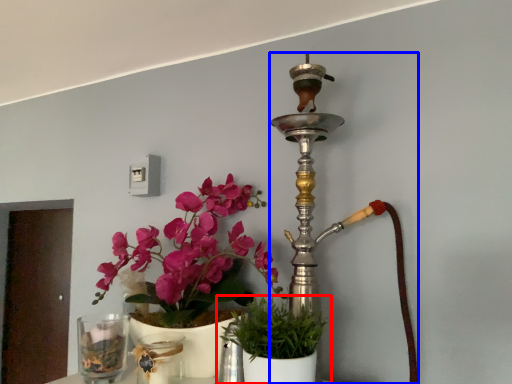
Question: Which of the following is the closest to the observer, houseplant (highlighted by a red box) or candle holder (highlighted by a blue box)?

Choices:
 (A) houseplant
 (B) candle holder

Answer: (A)